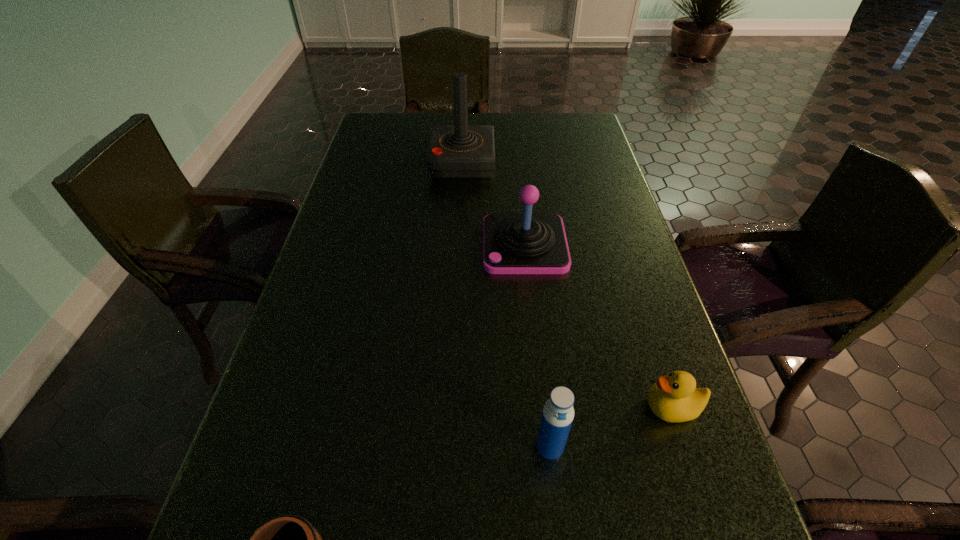
Where is `vacant space that satisfies the following two spatial constraints: 1. on the back side of the second nearest object; 2. forward from the base of the fourth nearest object`? The image size is (960, 540). vacant space that satisfies the following two spatial constraints: 1. on the back side of the second nearest object; 2. forward from the base of the fourth nearest object is located at coordinates (527, 245).

This screenshot has height=540, width=960. Identify the location of free space in the image that satisfies the following two spatial constraints: 1. forward from the base of the nearer joystick; 2. on the left side of the water bottle. (545, 447).

I want to click on vacant position in the image that satisfies the following two spatial constraints: 1. forward from the base of the second farthest object; 2. on the left side of the water bottle, so click(x=545, y=447).